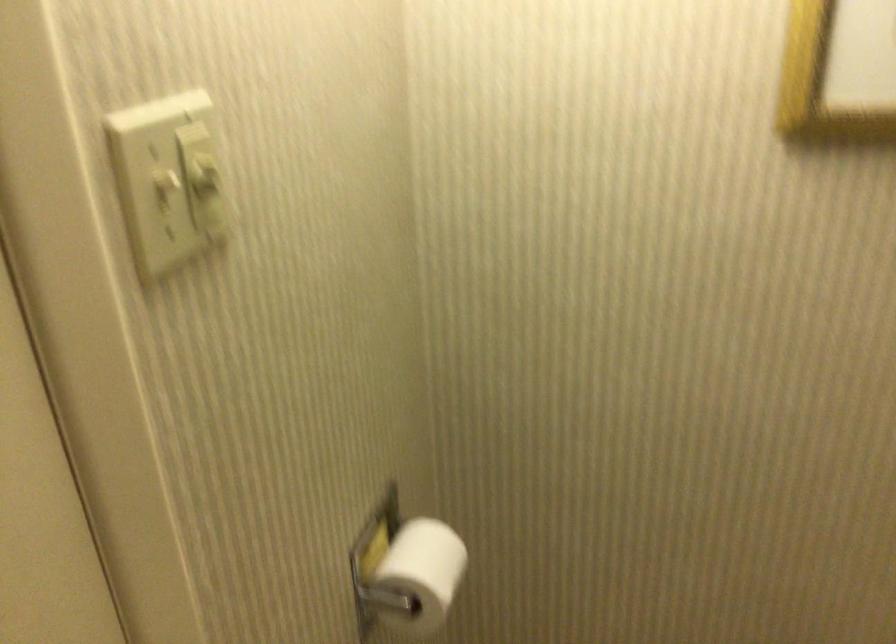
The width and height of the screenshot is (896, 644). Identify the location of white light switch. (168, 183).